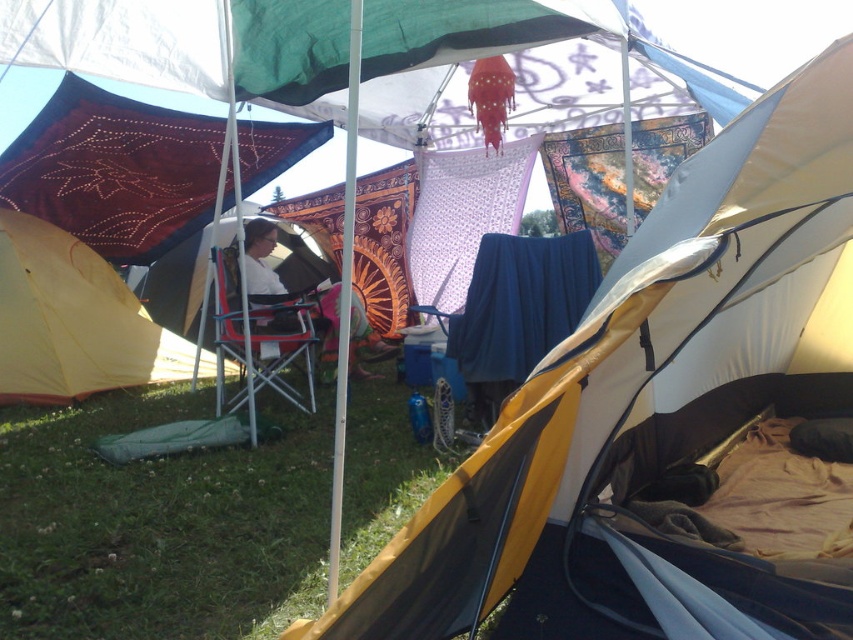
Which is in front, point (811, 618) or point (323, 291)?

Point (811, 618)

Which of these two, yellow fabric tent at center or white fabric chair at center, stands taller?

With more height is yellow fabric tent at center.

Where is `yellow fabric tent at center`? yellow fabric tent at center is located at coordinates (653, 404).

Is yellow fabric tent at center taller than green grass at lower left?

Indeed, yellow fabric tent at center has a greater height compared to green grass at lower left.

Between yellow fabric tent at center and green grass at lower left, which one appears on the right side from the viewer's perspective?

From the viewer's perspective, yellow fabric tent at center appears more on the right side.

Which is in front, point (664, 227) or point (181, 401)?

Point (664, 227)

Locate an element on the screen. The image size is (853, 640). yellow fabric tent at center is located at coordinates (653, 404).

Is green grass at lower left above white fabric chair at center?

No, green grass at lower left is not above white fabric chair at center.

The width and height of the screenshot is (853, 640). What are the coordinates of `green grass at lower left` in the screenshot? It's located at (160, 524).